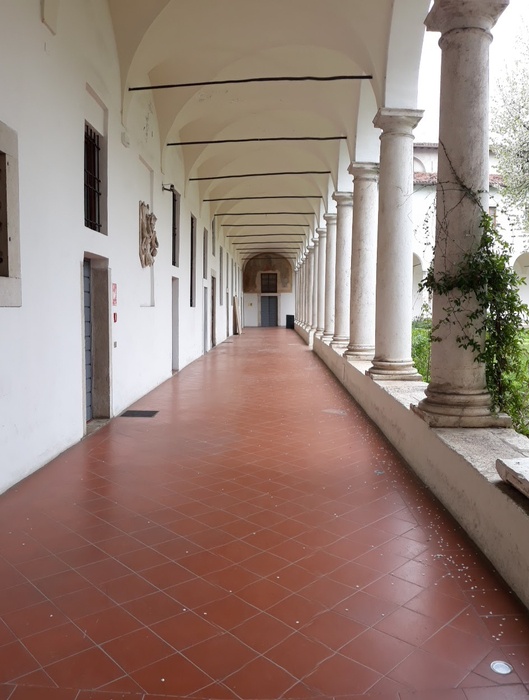
This screenshot has width=529, height=700. Identify the location of wall art. (145, 241).